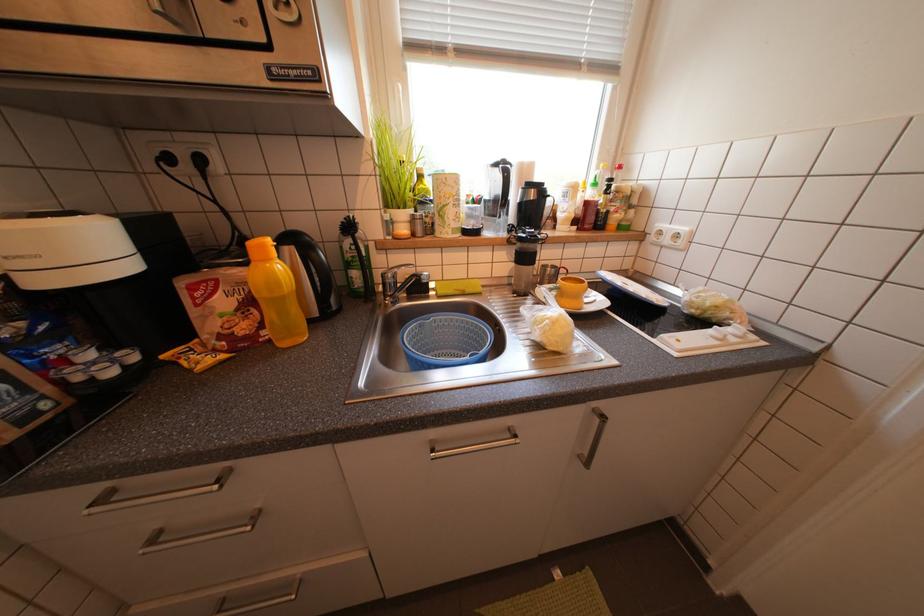
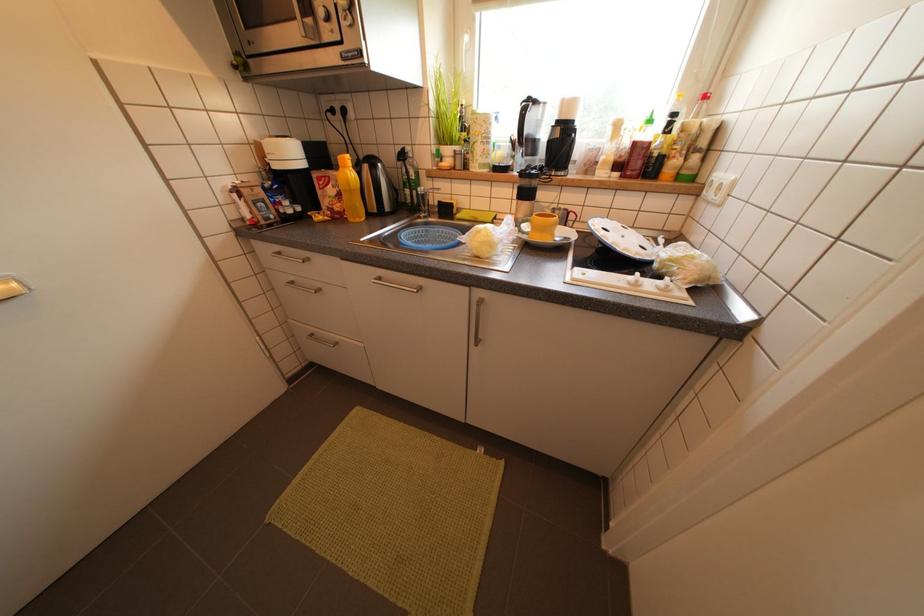
Question: How did the camera likely rotate?

Choices:
 (A) Left
 (B) Right
 (C) Up
 (D) Down

Answer: (A)